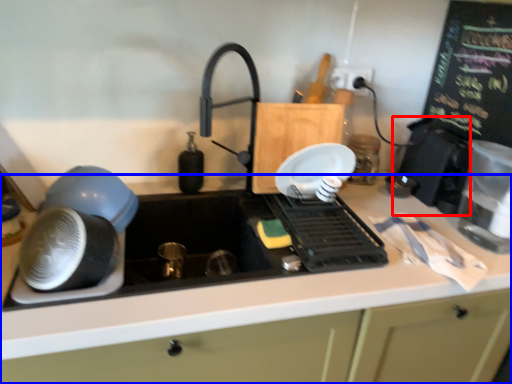
Question: Which of the following is the closest to the observer, appliance (highlighted by a red box) or countertop (highlighted by a blue box)?

Choices:
 (A) appliance
 (B) countertop

Answer: (B)